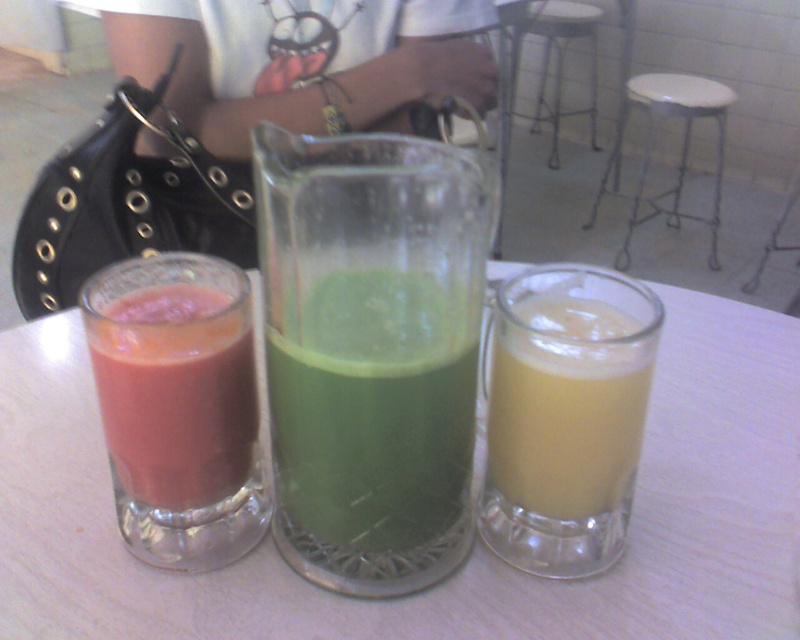
Does matte glass at left appear over metallic silver stool at lower right?

Actually, matte glass at left is below metallic silver stool at lower right.

Where is `matte glass at left`? matte glass at left is located at coordinates (176, 392).

Image resolution: width=800 pixels, height=640 pixels. In order to click on matte glass at left in this screenshot , I will do `click(176, 392)`.

Which is behind, point (556, 378) or point (664, 112)?

The point (664, 112) is behind.

Looking at this image, does yellow translucent glass at right have a larger size compared to white plastic stool at center?

No.

Which is in front, point (628, 333) or point (628, 90)?

Point (628, 333)

At what (x,y) coordinates should I click in order to perform the action: click on yellow translucent glass at right. Please return your answer as a coordinate pair (x, y). The width and height of the screenshot is (800, 640). Looking at the image, I should click on (566, 403).

Can you confirm if matte glass at left is positioned to the left of metallic silver stool at upper center?

Indeed, matte glass at left is positioned on the left side of metallic silver stool at upper center.

Does matte glass at left appear on the right side of metallic silver stool at upper center?

In fact, matte glass at left is to the left of metallic silver stool at upper center.

What are the coordinates of `matte glass at left` in the screenshot? It's located at (176, 392).